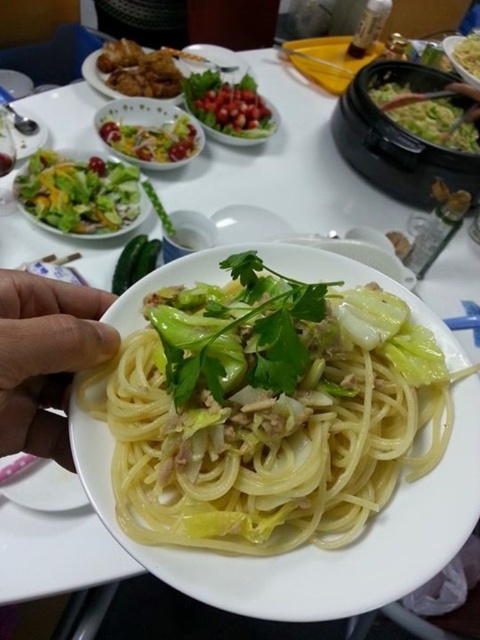
You are a food critic evaluating the layout of this meal presentation. The white glossy pasta at center and the fresh green salad at left are two key components. Based on their placement, which dish is more to the right?

The white glossy pasta at center is positioned on the right side of fresh green salad at left, so it is more to the right.

Based on the photo, you are a food critic sitting at the table. You want to reach for the fresh green salad at left and the green leafy vegetable at upper center. Which one is closer to you based on their positions?

The fresh green salad at left is located below the green leafy vegetable at upper center, so it is closer to you since it is positioned lower on the table.